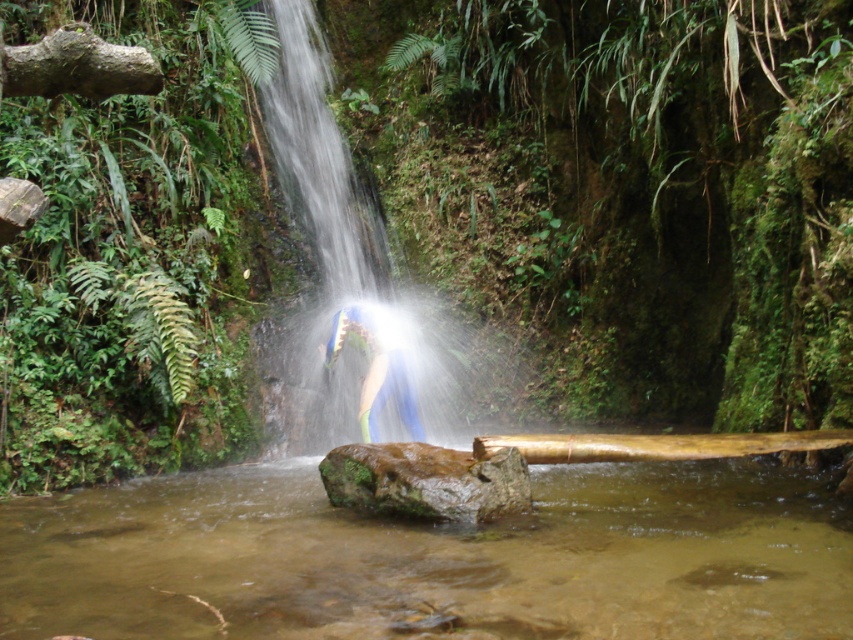
The image size is (853, 640). Describe the element at coordinates (426, 481) in the screenshot. I see `green mossy rock at center` at that location.

Can you confirm if green mossy rock at center is smaller than blue fabric at center?

Correct, green mossy rock at center occupies less space than blue fabric at center.

Is point (383, 483) farther from camera compared to point (402, 410)?

No, (383, 483) is in front of (402, 410).

You are a GUI agent. You are given a task and a screenshot of the screen. Output one action in this format:
    pyautogui.click(x=<x>, y=<y>)
    Task: Click on the green mossy rock at center
    
    Given the screenshot: What is the action you would take?
    pyautogui.click(x=426, y=481)

Between translucent water at center and blue fabric at center, which one appears on the right side from the viewer's perspective?

blue fabric at center

Is translucent water at center to the right of blue fabric at center from the viewer's perspective?

Incorrect, translucent water at center is not on the right side of blue fabric at center.

Where is `translucent water at center`? This screenshot has width=853, height=640. translucent water at center is located at coordinates (347, 250).

Does clear water stream at center appear over green mossy rock at center?

Incorrect, clear water stream at center is not positioned above green mossy rock at center.

Who is more forward, (x=720, y=630) or (x=346, y=506)?

Point (x=720, y=630) is more forward.

Where is `clear water stream at center`? Image resolution: width=853 pixels, height=640 pixels. clear water stream at center is located at coordinates (432, 557).